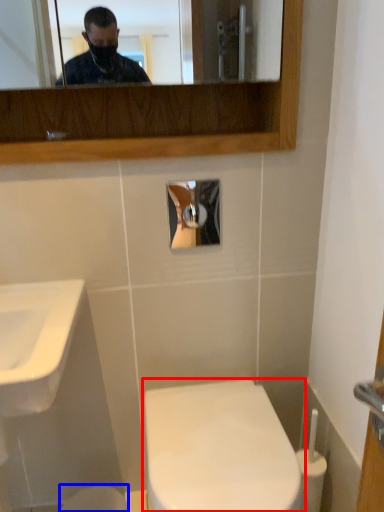
Question: Which object is further to the camera taking this photo, toilet (highlighted by a red box) or toilet bowl (highlighted by a blue box)?

Choices:
 (A) toilet
 (B) toilet bowl

Answer: (B)